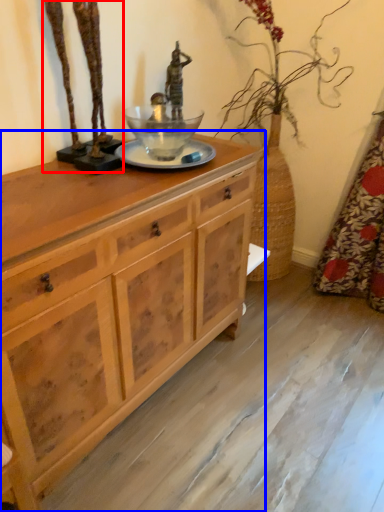
Question: Which of the following is the farthest to the observer, bronze statue (highlighted by a red box) or chest of drawers (highlighted by a blue box)?

Choices:
 (A) bronze statue
 (B) chest of drawers

Answer: (A)